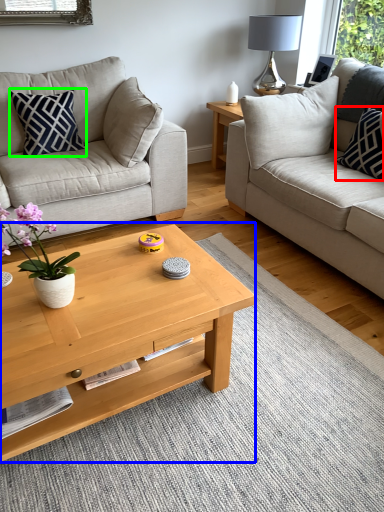
Question: Which object is positioned farthest from pillow (highlighted by a red box)? Select from coffee table (highlighted by a blue box) and pillow (highlighted by a green box).

Choices:
 (A) coffee table
 (B) pillow

Answer: (B)